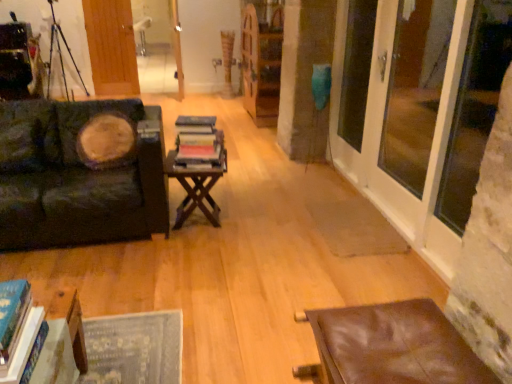
At what (x,y) coordinates should I click in order to perform the action: click on free space on the front side of brown wooden table at center, which appears as the first table when viewed from the top. Please return your answer as a coordinate pair (x, y). Looking at the image, I should click on (182, 249).